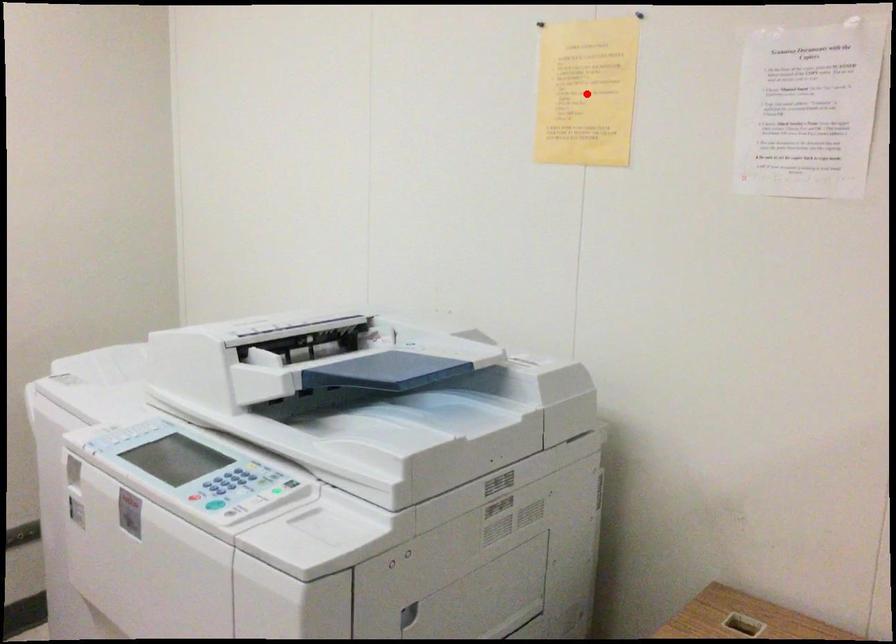
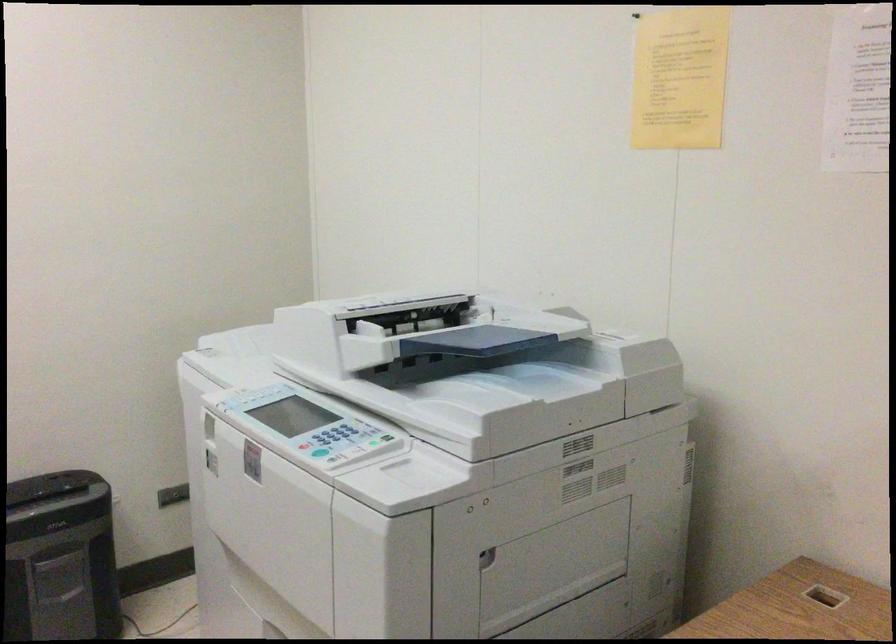
In the second image, find the point that corresponds to the highlighted location in the first image.

(679, 78)